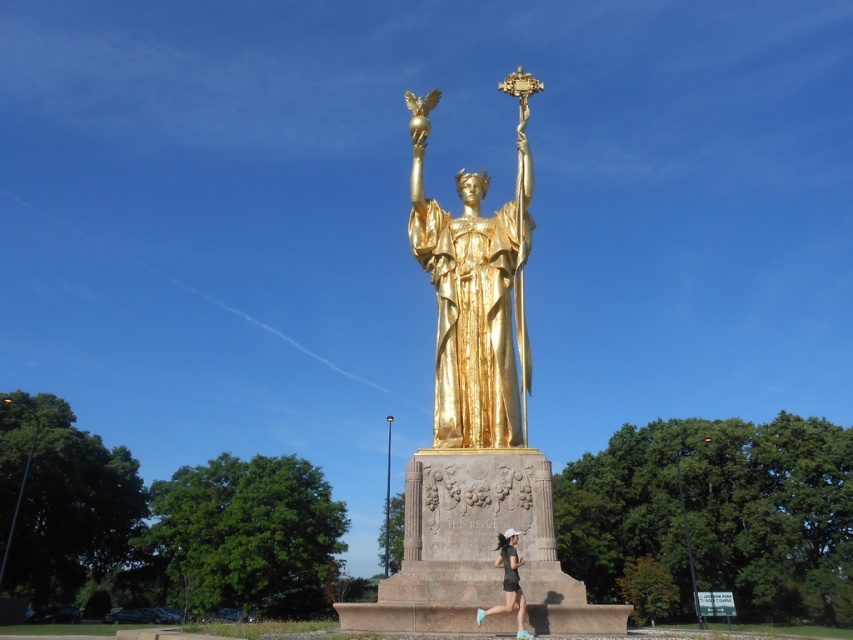
Looking at this image, which of these two, gold polished statue at center or gold statue at center, stands shorter?

With less height is gold statue at center.

Does gold polished statue at center appear on the right side of gold statue at center?

No, gold polished statue at center is not to the right of gold statue at center.

Which is behind, point (509, 349) or point (457, 285)?

The point (457, 285) is more distant.

I want to click on gold polished statue at center, so click(476, 420).

Image resolution: width=853 pixels, height=640 pixels. I want to click on gold statue at center, so click(x=473, y=298).

Does point (503, 304) lie in front of point (509, 588)?

No, it is not.

Is point (518, 307) closer to viewer compared to point (500, 547)?

No, (518, 307) is further to viewer.

Locate an element on the screen. Image resolution: width=853 pixels, height=640 pixels. gold statue at center is located at coordinates (473, 298).

Between gold polished statue at center and matte black shorts at lower center, which one has less height?

matte black shorts at lower center

Can you confirm if gold polished statue at center is positioned to the right of matte black shorts at lower center?

In fact, gold polished statue at center is to the left of matte black shorts at lower center.

Find the location of a particular element. Image resolution: width=853 pixels, height=640 pixels. gold polished statue at center is located at coordinates (476, 420).